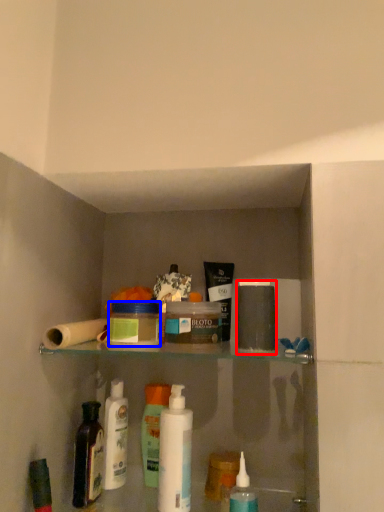
Question: Among these objects, which one is farthest to the camera, toiletry (highlighted by a red box) or product (highlighted by a blue box)?

Choices:
 (A) toiletry
 (B) product

Answer: (B)